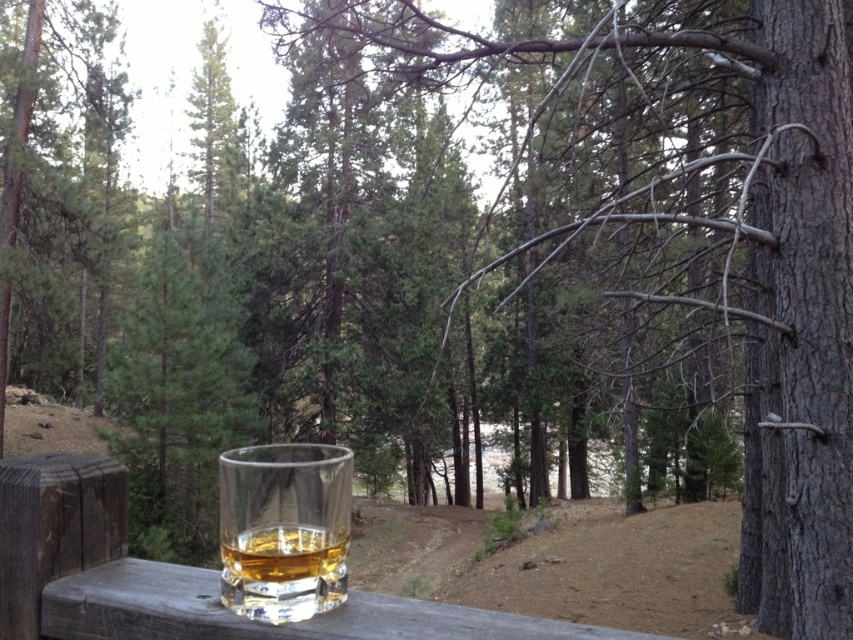
In the scene shown: You are standing on a wooden deck overlooking a forest. You see a green matte tree at center and a translucent glass at lower center. Which object is closer to you?

The green matte tree at center is closer to you because the translucent glass at lower center is behind it.

You are standing on a wooden deck and want to place a small potted plant between the green matte tree at center and the translucent glass at lower center. Considering their heights, which object should the plant be placed closer to?

The green matte tree at center is taller than the translucent glass at lower center, so the plant should be placed closer to the translucent glass at lower center to maintain proportional spacing.